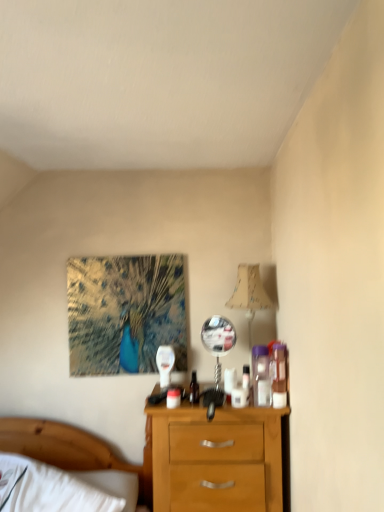
Question: Is translucent plastic container at right, which appears as the first toiletry when viewed from the right, turned away from translucent plastic container at right, arranged as the second toiletry when viewed from the right?

Choices:
 (A) yes
 (B) no

Answer: (B)

Question: Can we say translucent plastic container at right, the second toiletry positioned from the left, lies outside translucent plastic container at right, arranged as the second toiletry when viewed from the right?

Choices:
 (A) yes
 (B) no

Answer: (A)

Question: From a real-world perspective, does translucent plastic container at right, which appears as the first toiletry when viewed from the right, sit lower than translucent plastic container at right, arranged as the second toiletry when viewed from the right?

Choices:
 (A) yes
 (B) no

Answer: (B)

Question: From the image's perspective, would you say translucent plastic container at right, the second toiletry positioned from the left, is positioned over translucent plastic container at right, the 1th toiletry when ordered from left to right?

Choices:
 (A) yes
 (B) no

Answer: (A)

Question: Considering the relative sizes of translucent plastic container at right, which appears as the first toiletry when viewed from the right, and translucent plastic container at right, arranged as the second toiletry when viewed from the right, in the image provided, is translucent plastic container at right, which appears as the first toiletry when viewed from the right, shorter than translucent plastic container at right, arranged as the second toiletry when viewed from the right,?

Choices:
 (A) yes
 (B) no

Answer: (A)

Question: Is beige fabric lampshade at upper right inside or outside of matte plastic bottle at center?

Choices:
 (A) inside
 (B) outside

Answer: (B)

Question: Is beige fabric lampshade at upper right wider or thinner than matte plastic bottle at center?

Choices:
 (A) thin
 (B) wide

Answer: (B)

Question: Is point (251, 315) closer or farther from the camera than point (195, 390)?

Choices:
 (A) closer
 (B) farther

Answer: (B)

Question: In terms of height, does beige fabric lampshade at upper right look taller or shorter compared to matte plastic bottle at center?

Choices:
 (A) tall
 (B) short

Answer: (A)

Question: Looking at the image, does white wood bed at lower left seem bigger or smaller compared to translucent plastic container at right, which appears as the first toiletry when viewed from the right?

Choices:
 (A) big
 (B) small

Answer: (A)

Question: Is white wood bed at lower left situated inside translucent plastic container at right, which appears as the first toiletry when viewed from the right, or outside?

Choices:
 (A) outside
 (B) inside

Answer: (A)

Question: Is white wood bed at lower left taller or shorter than translucent plastic container at right, the second toiletry positioned from the left?

Choices:
 (A) tall
 (B) short

Answer: (A)

Question: Considering their positions, is white wood bed at lower left located in front of or behind translucent plastic container at right, the second toiletry positioned from the left?

Choices:
 (A) behind
 (B) front

Answer: (B)

Question: From the image's perspective, is beige fabric lampshade at upper right located above or below white wood bed at lower left?

Choices:
 (A) above
 (B) below

Answer: (A)

Question: Considering the positions of beige fabric lampshade at upper right and white wood bed at lower left in the image, is beige fabric lampshade at upper right bigger or smaller than white wood bed at lower left?

Choices:
 (A) small
 (B) big

Answer: (A)